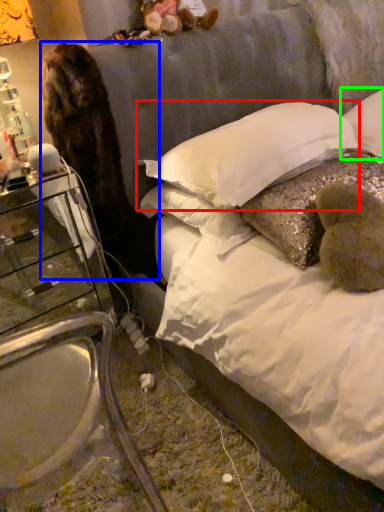
Question: Which is farther away from pillow (highlighted by a red box)? animal (highlighted by a blue box) or pillow (highlighted by a green box)?

Choices:
 (A) animal
 (B) pillow

Answer: (B)